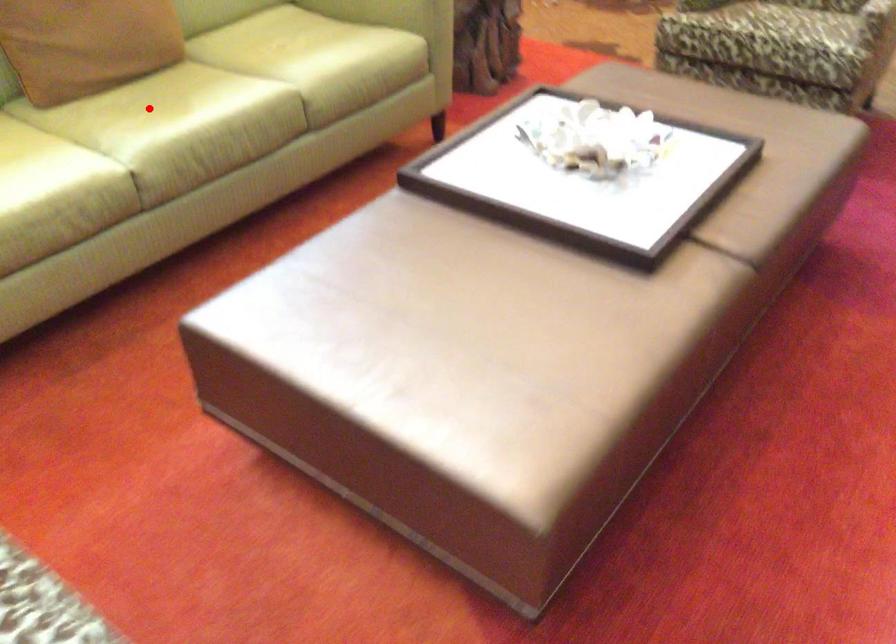
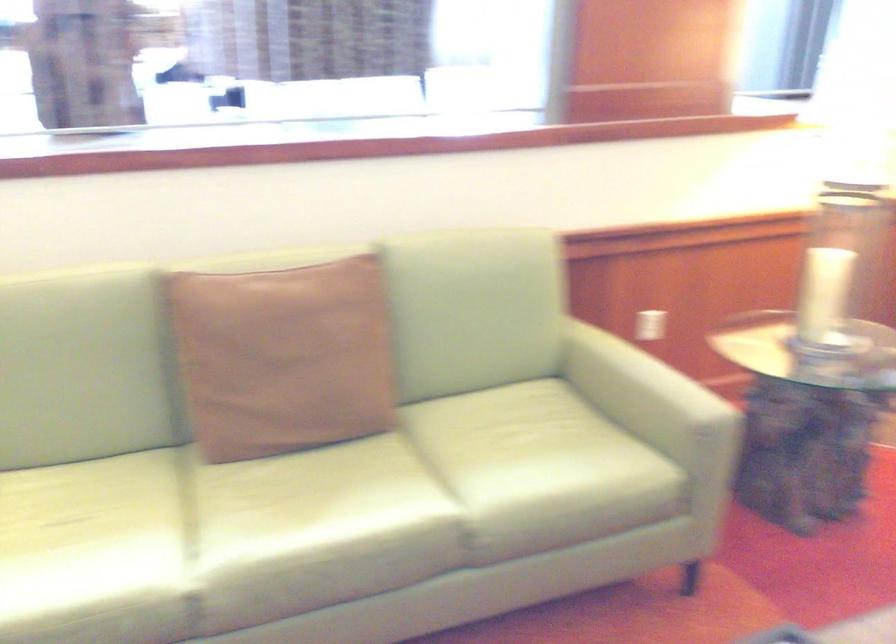
Find the pixel in the second image that matches the highlighted location in the first image.

(299, 498)